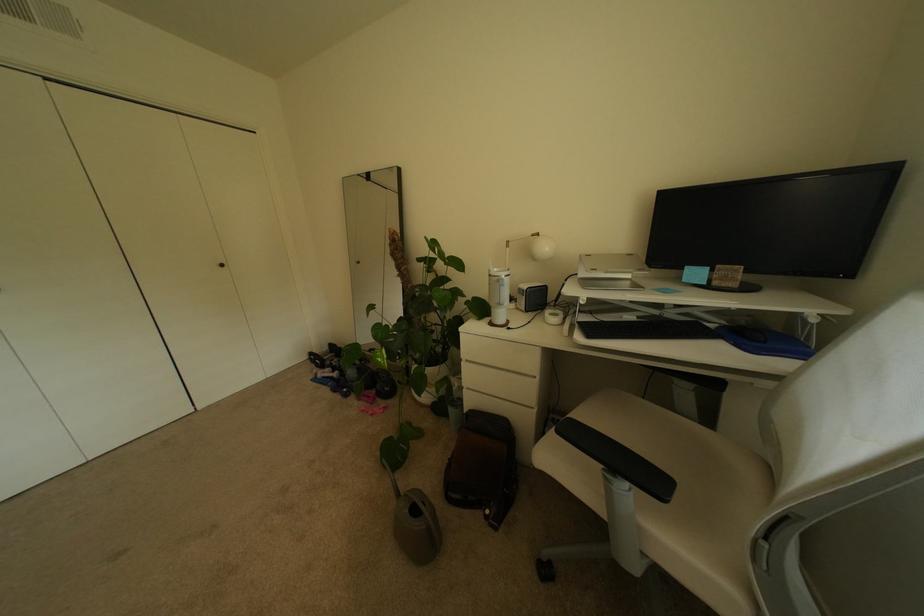
Locate an element on the screen. Image resolution: width=924 pixels, height=616 pixels. white water flosser is located at coordinates (506, 253).